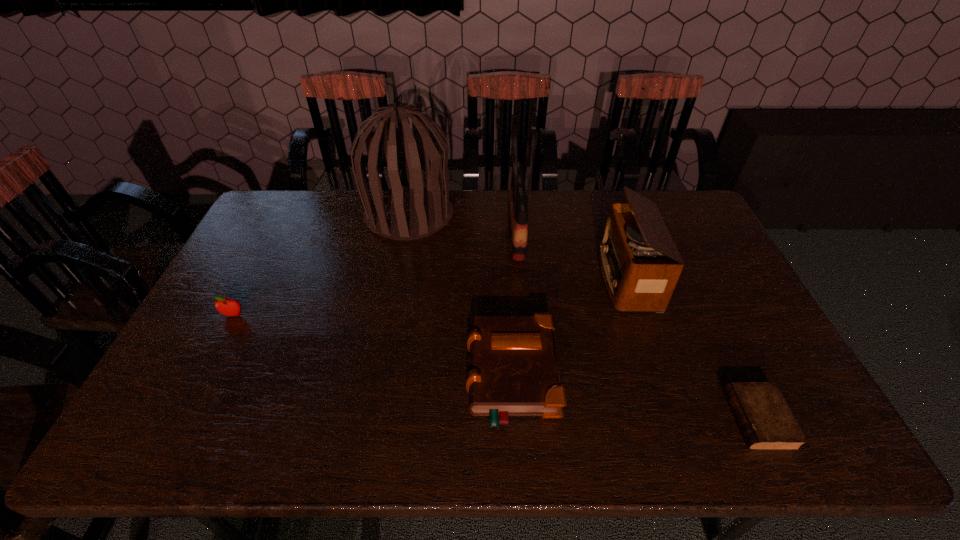
Locate an element on the screen. vacant area situated 0.220m on the front-facing side of the shopping bag is located at coordinates (441, 234).

Image resolution: width=960 pixels, height=540 pixels. Identify the location of blank space located on the front-facing side of the shopping bag. (438, 234).

This screenshot has height=540, width=960. What are the coordinates of `blank area located on the front panel of the second object from right to left` in the screenshot? It's located at (481, 278).

This screenshot has width=960, height=540. I want to click on free space located on the front panel of the second object from right to left, so tap(520, 278).

At what (x,y) coordinates should I click in order to perform the action: click on free space located 0.320m on the front panel of the second object from right to left. Please return your answer as a coordinate pair (x, y). Looking at the image, I should click on (497, 278).

Identify the location of vacant space located 0.090m on the front of the apple. This screenshot has width=960, height=540. (218, 346).

Identify the location of vacant area located on the spine side of the Bible. The height and width of the screenshot is (540, 960). (344, 376).

This screenshot has height=540, width=960. In order to click on vacant space located on the spine side of the Bible in this screenshot , I will do `click(407, 376)`.

Find the location of `blank space located on the spine side of the Bible`. blank space located on the spine side of the Bible is located at coordinates (332, 376).

The width and height of the screenshot is (960, 540). I want to click on free location located on the spine side of the shortest object, so click(600, 419).